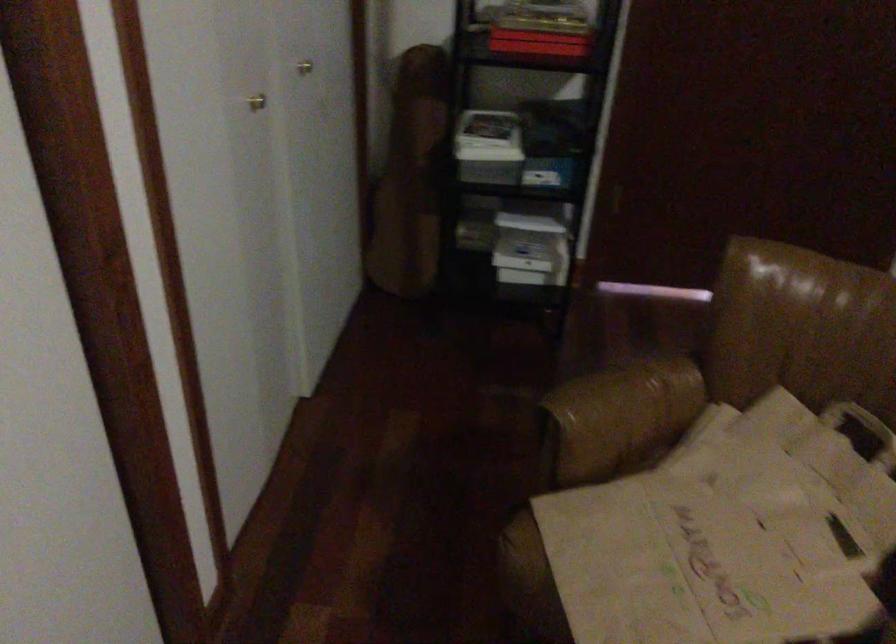
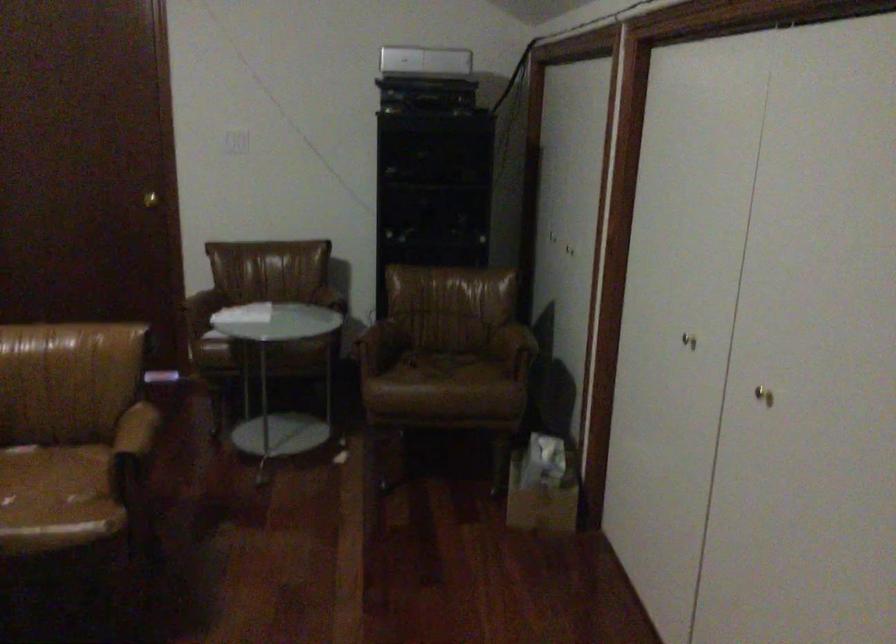
Looking at this image, which direction would the cameraman need to move to produce the second image?

The movement direction of the cameraman is right, backward.